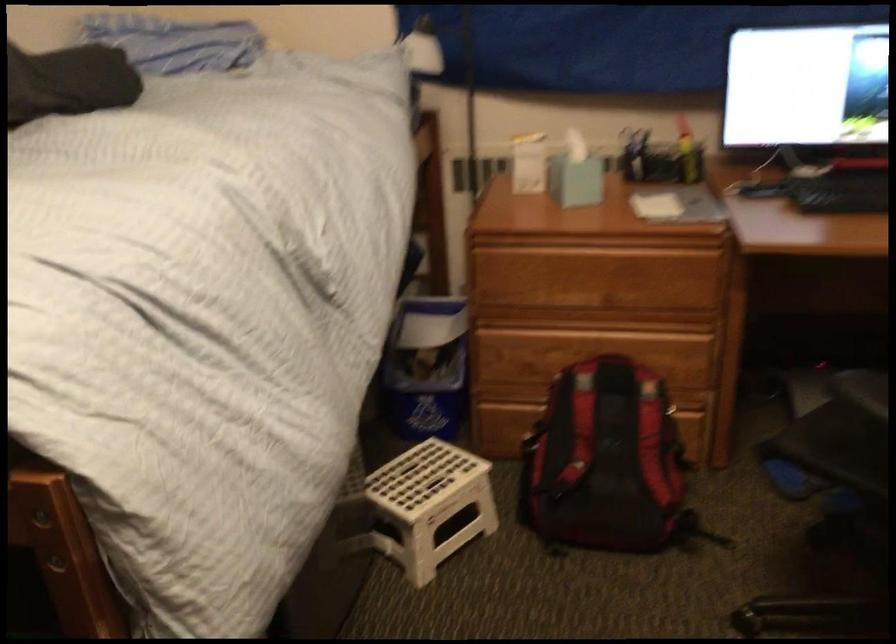
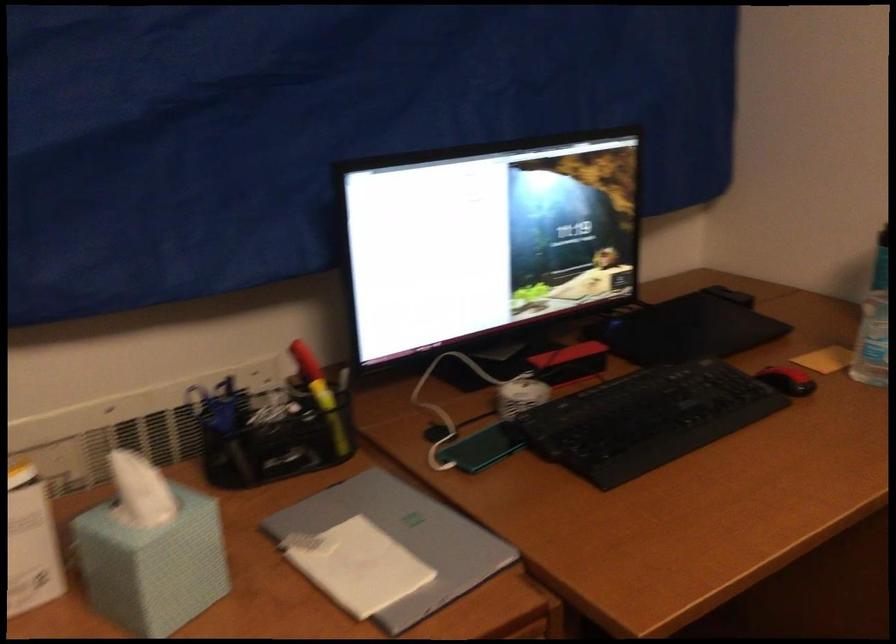
Find the pixel in the second image that matches point 655,204 in the first image.

(357, 565)